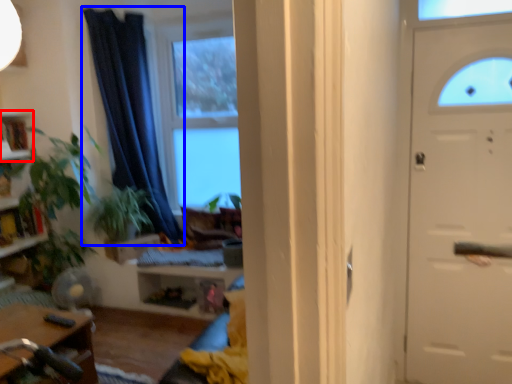
Question: Among these objects, which one is farthest to the camera, shelf (highlighted by a red box) or curtain (highlighted by a blue box)?

Choices:
 (A) shelf
 (B) curtain

Answer: (A)